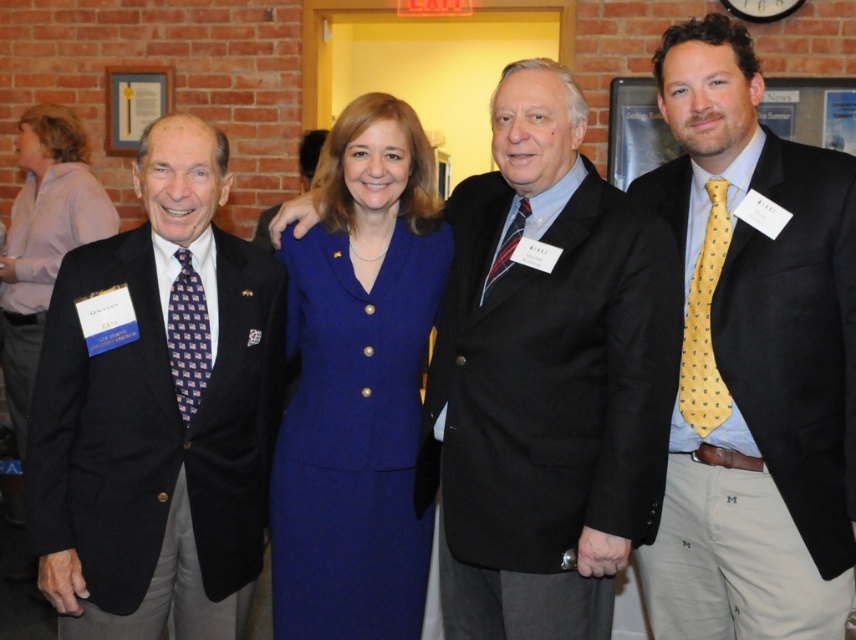
You are a photographer at the event and need to adjust the lighting to ensure both the matte black suit at left and the blue fabric dress at center are well lit. Which object is closer to the left side of the frame?

The matte black suit at left is positioned on the right side of the blue fabric dress at center, so the blue fabric dress at center is closer to the left side of the frame.

You are standing at the origin of the coordinate system in the image. You see two points labeled as point (595, 288) and point (61, 220). Which point is closer to you?

Point (61, 220) is closer to you because it has a smaller y coordinate than point (595, 288), which is further away in the positive y direction.

You are standing at the origin point in the image. The point at coordinates (159, 412) is marked. Which object does this point indicate?

The point at coordinates (159, 412) marks the matte black suit at left.